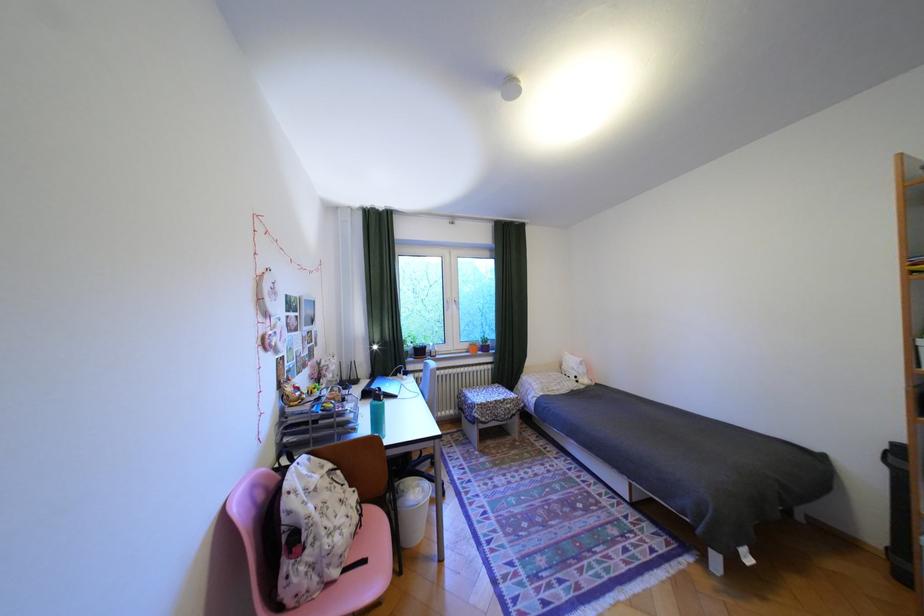
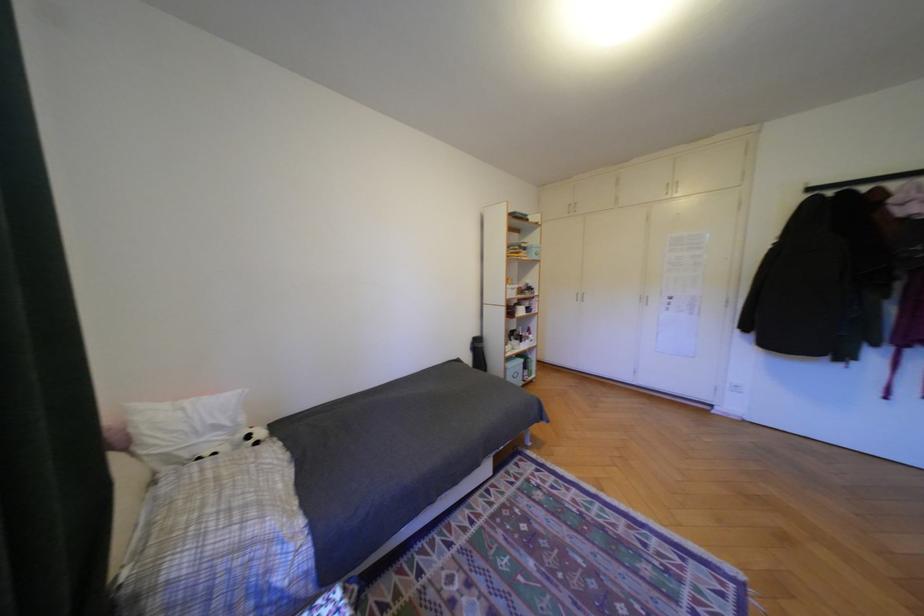
In the second image, find the point that corresponds to point (585, 369) in the first image.

(228, 427)